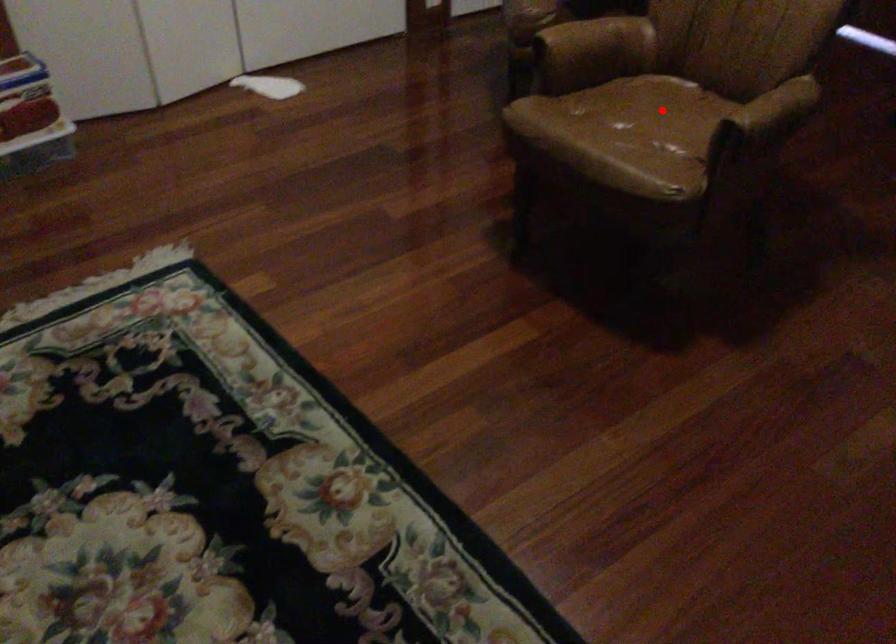
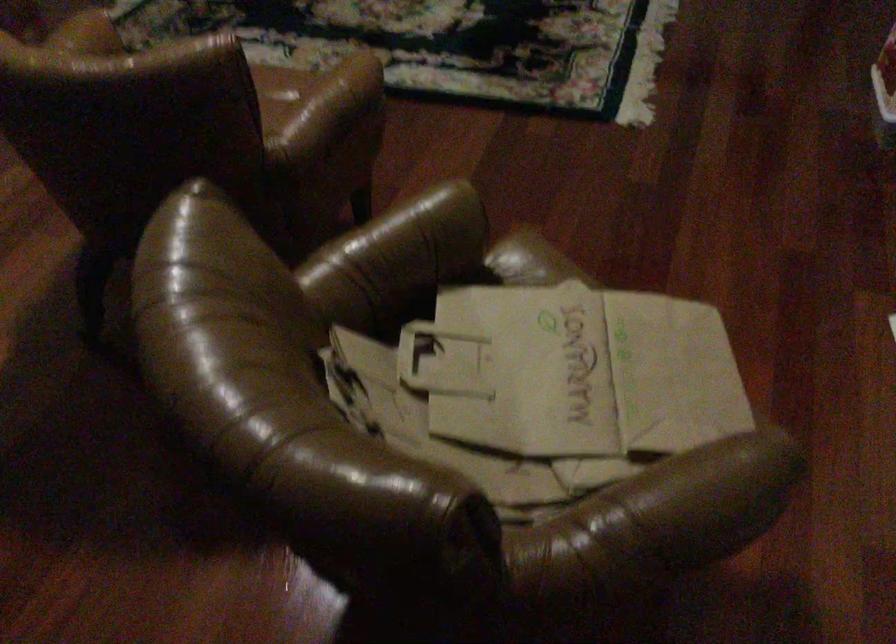
Question: I am providing you with two images of the same scene from different viewpoints. A red point is marked on the first image. At the location where the point appears in image 1, is it still visible in image 2?

Choices:
 (A) Yes
 (B) No

Answer: (B)